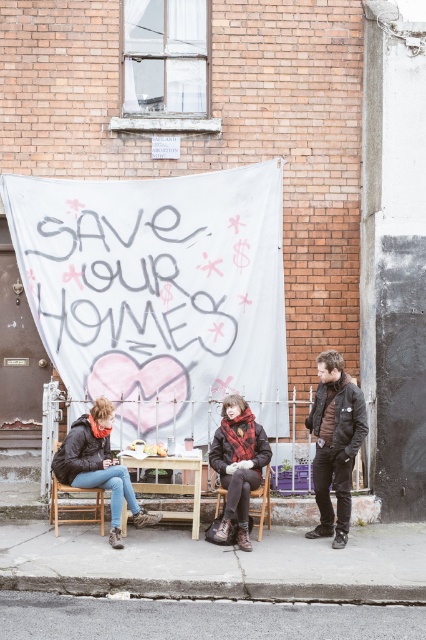
Can you confirm if leather jacket at right is smaller than wooden chair at lower left?

No, leather jacket at right is not smaller than wooden chair at lower left.

Can you confirm if leather jacket at right is positioned to the left of wooden chair at lower left?

In fact, leather jacket at right is to the right of wooden chair at lower left.

Does point (334, 436) lie in front of point (62, 490)?

Yes, point (334, 436) is closer to viewer.

In order to click on leather jacket at right in this screenshot , I will do `click(334, 442)`.

Who is more forward, (112, 515) or (101, 496)?

Point (112, 515) is more forward.

What do you see at coordinates (97, 465) in the screenshot?
I see `leather jacket at center` at bounding box center [97, 465].

I want to click on leather jacket at center, so click(97, 465).

Between matte black jacket at lower left and leather jacket at center, which one is positioned lower?

matte black jacket at lower left is below.

This screenshot has height=640, width=426. Describe the element at coordinates (98, 465) in the screenshot. I see `matte black jacket at lower left` at that location.

You are a GUI agent. You are given a task and a screenshot of the screen. Output one action in this format:
    pyautogui.click(x=<x>, y=<y>)
    Task: Click on the matte black jacket at lower left
    The width and height of the screenshot is (426, 640).
    Given the screenshot: What is the action you would take?
    pyautogui.click(x=98, y=465)